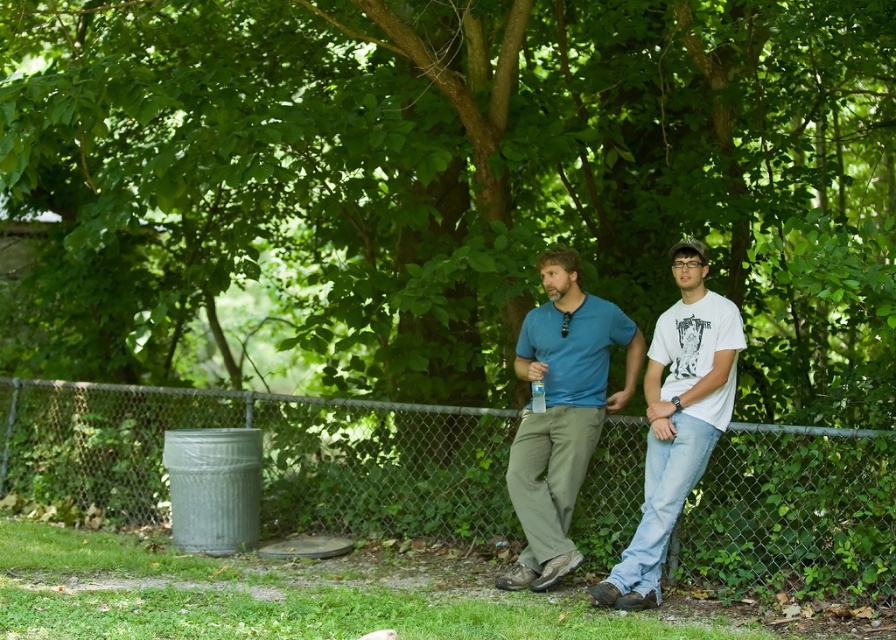
Between point (556, 509) and point (662, 465), which one is positioned in front?

Point (662, 465) is more forward.

Is point (564, 435) more distant than point (721, 324)?

Yes, point (564, 435) is farther from viewer.

Does point (588, 362) lie behind point (674, 381)?

Yes.

The width and height of the screenshot is (896, 640). What are the coordinates of `matte blue shirt at center` in the screenshot? It's located at coord(561,413).

Does metal chain-link fence at center have a greater width compared to matte blue shirt at center?

No, metal chain-link fence at center is not wider than matte blue shirt at center.

Consider the image. Between metal chain-link fence at center and matte blue shirt at center, which one has less height?

Standing shorter between the two is metal chain-link fence at center.

The height and width of the screenshot is (640, 896). Describe the element at coordinates (266, 456) in the screenshot. I see `metal chain-link fence at center` at that location.

Identify the location of metal chain-link fence at center. The image size is (896, 640). (266, 456).

Is metal chain-link fence at center to the left of white cotton t-shirt at right from the viewer's perspective?

Incorrect, metal chain-link fence at center is not on the left side of white cotton t-shirt at right.

Locate an element on the screen. The image size is (896, 640). metal chain-link fence at center is located at coordinates (266, 456).

Identify the location of metal chain-link fence at center. The height and width of the screenshot is (640, 896). (266, 456).